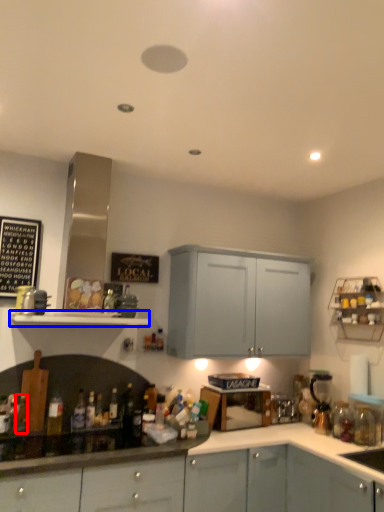
Question: Which of the following is the closest to the observer, bottle (highlighted by a red box) or shelf (highlighted by a blue box)?

Choices:
 (A) bottle
 (B) shelf

Answer: (B)